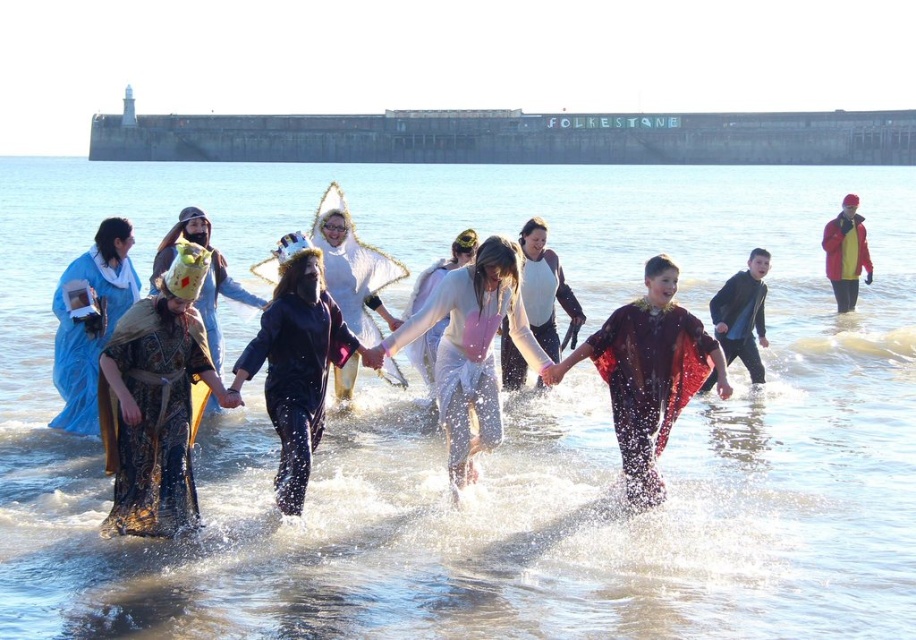
Question: Estimate the real-world distances between objects in this image. Which object is closer to the white satin dress at center?

Choices:
 (A) gold brocade cape at center
 (B) white matte dress at center
 (C) camouflage fabric costume at center
 (D) white matte shark fin at center

Answer: (D)

Question: Which point is farther to the camera?

Choices:
 (A) (420, 292)
 (B) (691, 333)
 (C) (235, 534)

Answer: (A)

Question: Does white matte dress at center have a smaller size compared to blue fabric dress at left?

Choices:
 (A) yes
 (B) no

Answer: (B)

Question: Does white matte dress at center have a lesser width compared to camouflage fabric costume at center?

Choices:
 (A) yes
 (B) no

Answer: (B)

Question: Is yellow-orange fabric coat at right smaller than white satin dress at center?

Choices:
 (A) yes
 (B) no

Answer: (A)

Question: Which point is closer to the camera?

Choices:
 (A) (426, 332)
 (B) (729, 332)
 (C) (508, 342)

Answer: (A)